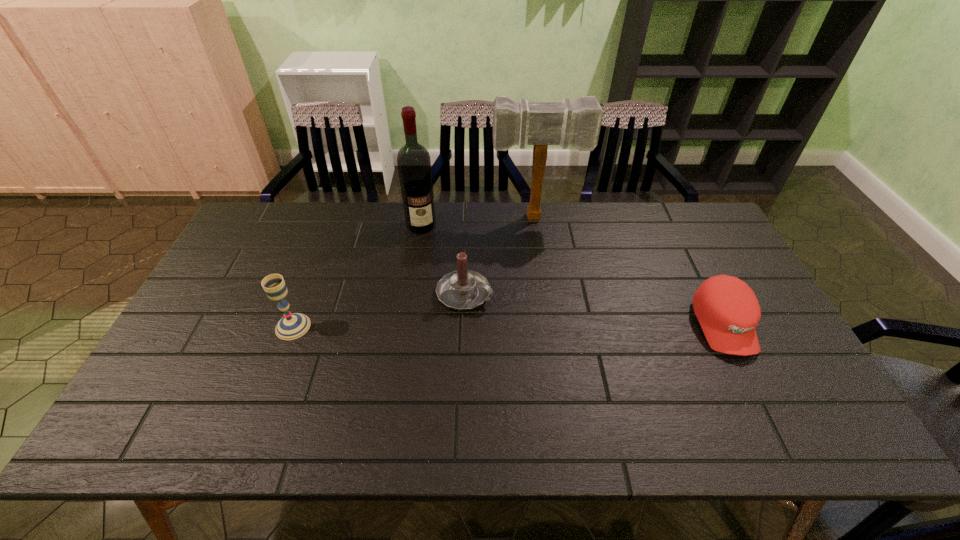
Locate an element on the screen. This screenshot has width=960, height=540. free space located 0.210m on the side of the candle with the handle loop is located at coordinates (556, 336).

Locate an element on the screen. vacant space located at the head of the mallet is located at coordinates (548, 313).

In order to click on free region located 0.100m at the head of the mallet in this screenshot , I will do `click(540, 245)`.

Identify the location of vacant region located 0.100m at the head of the mallet. (540, 245).

Where is `vacant space located 0.160m on the front and back of the alcohol`? The image size is (960, 540). vacant space located 0.160m on the front and back of the alcohol is located at coordinates (432, 266).

Identify the location of vacant space located on the front and back of the alcohol. This screenshot has width=960, height=540. (432, 268).

Image resolution: width=960 pixels, height=540 pixels. I want to click on vacant space located on the front and back of the alcohol, so click(427, 249).

This screenshot has height=540, width=960. I want to click on mallet that is positioned at the far edge, so click(x=578, y=123).

Where is `alcohol situated at the far edge`? This screenshot has height=540, width=960. alcohol situated at the far edge is located at coordinates (414, 165).

Find the location of a particular element. The width and height of the screenshot is (960, 540). object at the right edge is located at coordinates (727, 309).